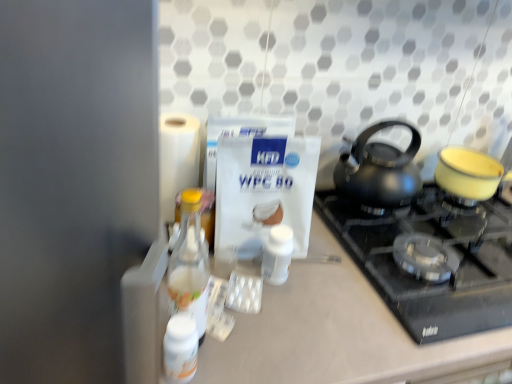
Question: Does clear glass bottle at left, the first bottle from the front, have a greater width compared to black matte kettle at upper right?

Choices:
 (A) no
 (B) yes

Answer: (A)

Question: Is clear glass bottle at left, arranged as the third bottle when viewed from the back, smaller than black matte kettle at upper right?

Choices:
 (A) no
 (B) yes

Answer: (B)

Question: Could you tell me if clear glass bottle at left, the second bottle in the right-to-left sequence, is facing black matte kettle at upper right?

Choices:
 (A) no
 (B) yes

Answer: (A)

Question: Are clear glass bottle at left, the second bottle in the right-to-left sequence, and black matte kettle at upper right far apart?

Choices:
 (A) no
 (B) yes

Answer: (A)

Question: Is clear glass bottle at left, arranged as the third bottle when viewed from the back, positioned behind black matte kettle at upper right?

Choices:
 (A) yes
 (B) no

Answer: (B)

Question: Considering the positions of white glossy bottle at lower left, which ranks as the 2th bottle in back-to-front order, and white matte bottle at center, arranged as the 3th bottle when viewed from the left, in the image, is white glossy bottle at lower left, which ranks as the 2th bottle in back-to-front order, taller or shorter than white matte bottle at center, arranged as the 3th bottle when viewed from the left,?

Choices:
 (A) tall
 (B) short

Answer: (B)

Question: From a real-world perspective, is white glossy bottle at lower left, which ranks as the 2th bottle in back-to-front order, above or below white matte bottle at center, the 3th bottle viewed from the front?

Choices:
 (A) below
 (B) above

Answer: (A)

Question: Is white glossy bottle at lower left, the second bottle positioned from the front, to the left or to the right of white matte bottle at center, arranged as the 3th bottle when viewed from the left, in the image?

Choices:
 (A) right
 (B) left

Answer: (B)

Question: Considering the positions of white glossy bottle at lower left, the first bottle from the left, and white matte bottle at center, the 3th bottle viewed from the front, in the image, is white glossy bottle at lower left, the first bottle from the left, wider or thinner than white matte bottle at center, the 3th bottle viewed from the front,?

Choices:
 (A) thin
 (B) wide

Answer: (A)

Question: In the image, is clear glass bottle at left, the first bottle from the front, positioned in front of or behind white matte toilet paper at left?

Choices:
 (A) behind
 (B) front

Answer: (B)

Question: Is clear glass bottle at left, the first bottle from the front, wider or thinner than white matte toilet paper at left?

Choices:
 (A) wide
 (B) thin

Answer: (B)

Question: In terms of size, does clear glass bottle at left, the first bottle from the front, appear bigger or smaller than white matte toilet paper at left?

Choices:
 (A) small
 (B) big

Answer: (A)

Question: From a real-world perspective, relative to white matte toilet paper at left, is clear glass bottle at left, the second bottle in the right-to-left sequence, vertically above or below?

Choices:
 (A) above
 (B) below

Answer: (A)

Question: Looking at their shapes, would you say black glass gas stove at center is wider or thinner than clear glass bottle at left, arranged as the third bottle when viewed from the back?

Choices:
 (A) wide
 (B) thin

Answer: (A)

Question: Is black glass gas stove at center situated inside clear glass bottle at left, the first bottle from the front, or outside?

Choices:
 (A) inside
 (B) outside

Answer: (B)